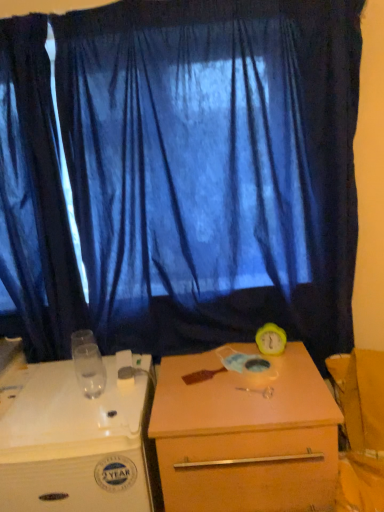
Where is `empty space that is ontop of matte wooden desk at center, placed as the first desk when sorted from right to left (from a real-world perspective)`? Image resolution: width=384 pixels, height=512 pixels. empty space that is ontop of matte wooden desk at center, placed as the first desk when sorted from right to left (from a real-world perspective) is located at coordinates (236, 378).